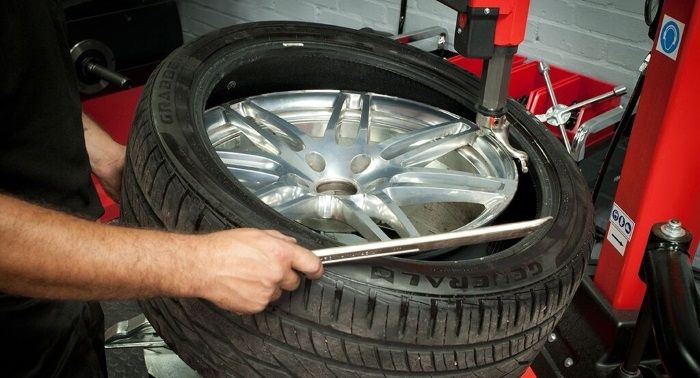
Find the location of a particular element. The image size is (700, 378). red bin is located at coordinates (580, 85), (530, 84), (472, 67).